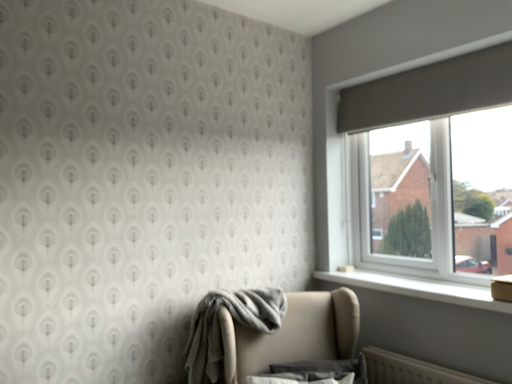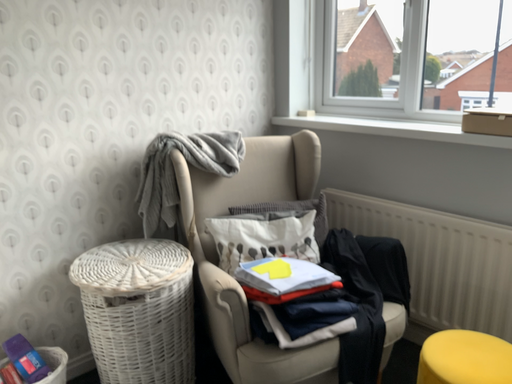
Question: How did the camera likely rotate when shooting the video?

Choices:
 (A) rotated right
 (B) rotated left

Answer: (A)